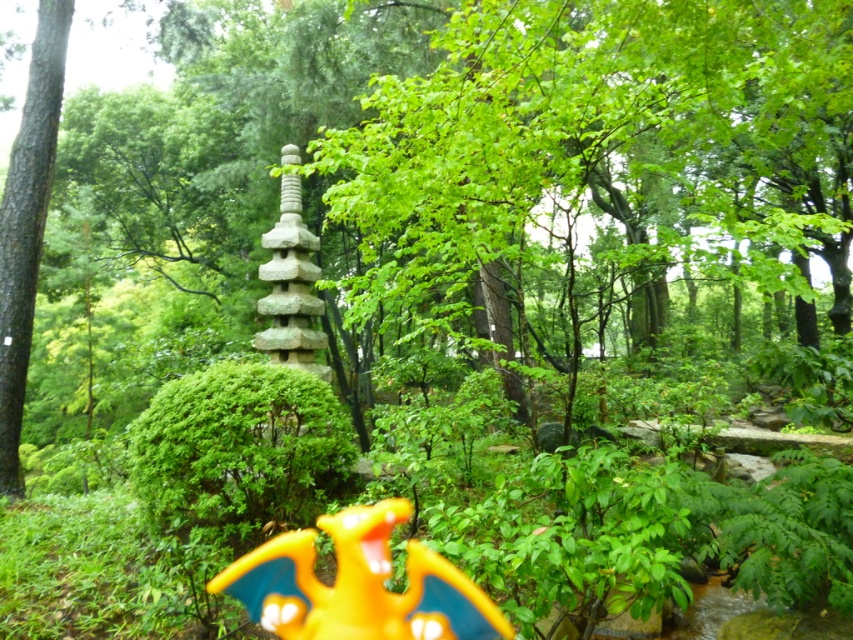
Question: Among these points, which one is nearest to the camera?

Choices:
 (A) (376, 509)
 (B) (15, 483)

Answer: (A)

Question: Is yellow matte toy dragon at lower center smaller than green rough bark tree at left?

Choices:
 (A) yes
 (B) no

Answer: (A)

Question: Among these points, which one is nearest to the camera?

Choices:
 (A) (395, 628)
 (B) (0, 208)

Answer: (A)

Question: Which of the following is the farthest from the observer?

Choices:
 (A) green rough bark tree at left
 (B) yellow matte toy dragon at lower center

Answer: (A)

Question: Observing the image, what is the correct spatial positioning of yellow matte toy dragon at lower center in reference to green rough bark tree at left?

Choices:
 (A) below
 (B) above

Answer: (A)

Question: Is yellow matte toy dragon at lower center wider than green rough bark tree at left?

Choices:
 (A) no
 (B) yes

Answer: (B)